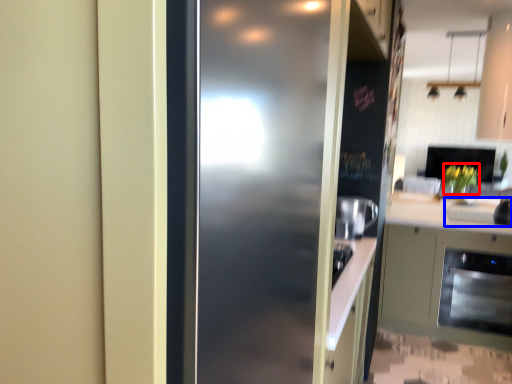
Question: Which object appears farthest to the camera in this image, flower (highlighted by a red box) or sink (highlighted by a blue box)?

Choices:
 (A) flower
 (B) sink

Answer: (A)